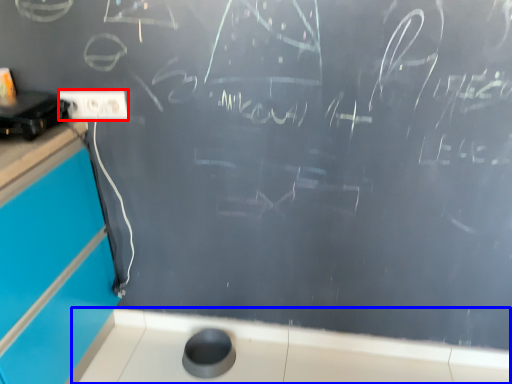
Question: Which point is further to the camera, electric outlet (highlighted by a red box) or counter top (highlighted by a blue box)?

Choices:
 (A) electric outlet
 (B) counter top

Answer: (B)